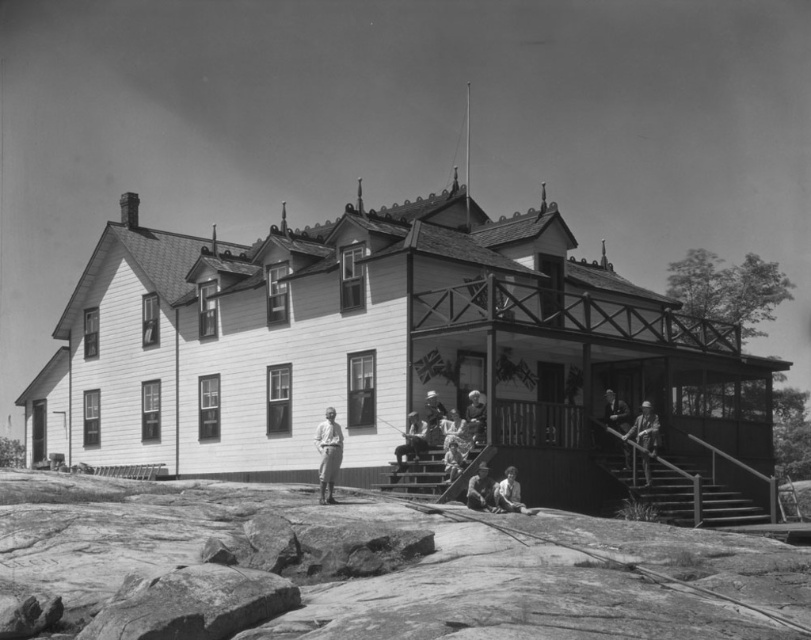
Does wooden stairs at center have a lesser height compared to smooth skin person at lower right?

No, wooden stairs at center is not shorter than smooth skin person at lower right.

This screenshot has height=640, width=811. What do you see at coordinates (637, 484) in the screenshot? I see `wooden stairs at center` at bounding box center [637, 484].

Who is more distant from viewer, (672, 516) or (620, 404)?

The point (620, 404) is behind.

The width and height of the screenshot is (811, 640). Find the location of `wooden stairs at center`. wooden stairs at center is located at coordinates (637, 484).

Does wooden stairs at center come behind wooden helmet at center?

No.

Which is above, wooden stairs at center or wooden helmet at center?

wooden helmet at center is above.

Identify the location of wooden stairs at center. The image size is (811, 640). (637, 484).

Identify the location of wooden stairs at center. (637, 484).

Is point (560, 492) positioned behind point (473, 420)?

Yes.

Is point (744, 493) positioned behind point (466, 408)?

Yes.

Find the location of a particular element. wooden stairs at center is located at coordinates click(637, 484).